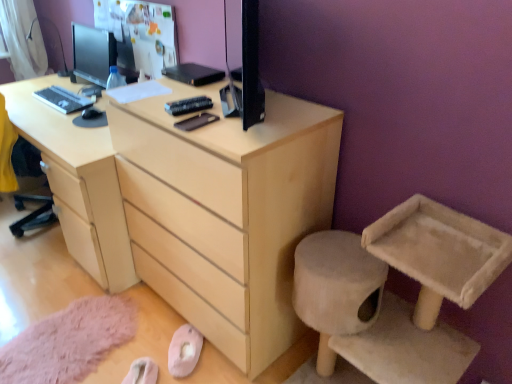
Where is `vacant point above light wood desk at center (from a real-world perspective)`? Image resolution: width=512 pixels, height=384 pixels. vacant point above light wood desk at center (from a real-world perspective) is located at coordinates (54, 95).